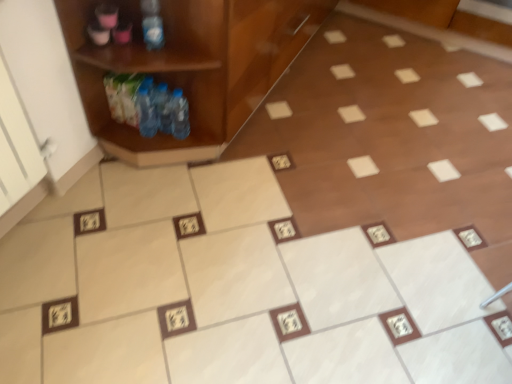
Question: Is wooden cabinet at left oriented towards blue plastic bottle at upper left, the 1th bottle in the top-to-bottom sequence?

Choices:
 (A) no
 (B) yes

Answer: (B)

Question: From a real-world perspective, is wooden cabinet at left beneath blue plastic bottle at upper left, arranged as the first bottle when viewed from the front?

Choices:
 (A) no
 (B) yes

Answer: (B)

Question: Is wooden cabinet at left to the right of blue plastic bottle at upper left, arranged as the first bottle when viewed from the front, from the viewer's perspective?

Choices:
 (A) no
 (B) yes

Answer: (B)

Question: Can you confirm if wooden cabinet at left is thinner than blue plastic bottle at upper left, the second bottle ordered from the bottom?

Choices:
 (A) yes
 (B) no

Answer: (B)

Question: Considering the relative sizes of wooden cabinet at left and blue plastic bottle at upper left, the 1th bottle in the top-to-bottom sequence, in the image provided, is wooden cabinet at left bigger than blue plastic bottle at upper left, the 1th bottle in the top-to-bottom sequence,?

Choices:
 (A) no
 (B) yes

Answer: (B)

Question: Can you confirm if wooden cabinet at left is positioned to the left of blue plastic bottle at upper left, arranged as the first bottle when viewed from the front?

Choices:
 (A) yes
 (B) no

Answer: (B)

Question: Does wooden cabinet at left have a greater width compared to translucent plastic bottle at left, which is the first bottle from bottom to top?

Choices:
 (A) no
 (B) yes

Answer: (B)

Question: From a real-world perspective, is wooden cabinet at left physically above translucent plastic bottle at left, which is counted as the 2th bottle, starting from the front?

Choices:
 (A) yes
 (B) no

Answer: (A)

Question: Is wooden cabinet at left outside of translucent plastic bottle at left, which is counted as the 2th bottle, starting from the front?

Choices:
 (A) no
 (B) yes

Answer: (B)

Question: Is wooden cabinet at left taller than translucent plastic bottle at left, which is the first bottle from bottom to top?

Choices:
 (A) no
 (B) yes

Answer: (B)

Question: Are wooden cabinet at left and translucent plastic bottle at left, which ranks as the second bottle in top-to-bottom order, making contact?

Choices:
 (A) yes
 (B) no

Answer: (B)

Question: Does wooden cabinet at left appear on the right side of translucent plastic bottle at left, acting as the first bottle starting from the back?

Choices:
 (A) yes
 (B) no

Answer: (A)

Question: Is blue plastic bottle at upper left, the 1th bottle in the top-to-bottom sequence, taller than wooden cabinet at left?

Choices:
 (A) no
 (B) yes

Answer: (A)